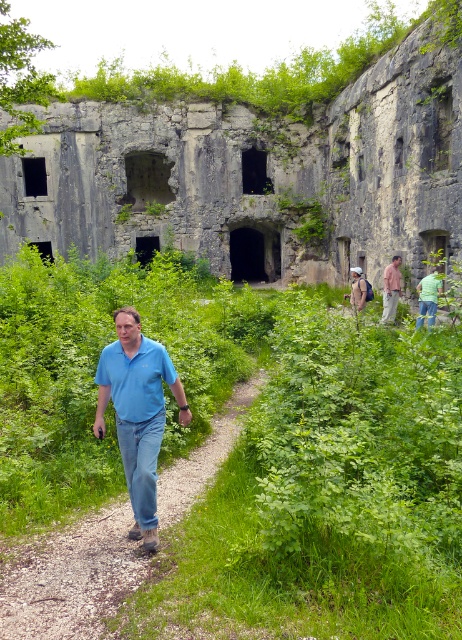
Is blue denim jeans at center to the left of pink fabric shirt at center from the viewer's perspective?

Correct, you'll find blue denim jeans at center to the left of pink fabric shirt at center.

Which is more to the left, blue denim jeans at center or pink fabric shirt at center?

blue denim jeans at center

Who is more distant from viewer, (x=180, y=390) or (x=385, y=310)?

Point (x=385, y=310)

Find the location of a particular element. The width and height of the screenshot is (462, 640). blue denim jeans at center is located at coordinates (138, 412).

From the picture: Does green leafy vegetation at center have a lesser height compared to gray stone ruins at center?

Correct, green leafy vegetation at center is not as tall as gray stone ruins at center.

What do you see at coordinates (249, 452) in the screenshot? This screenshot has width=462, height=640. I see `green leafy vegetation at center` at bounding box center [249, 452].

What do you see at coordinates (249, 452) in the screenshot? This screenshot has width=462, height=640. I see `green leafy vegetation at center` at bounding box center [249, 452].

Locate an element on the screen. This screenshot has width=462, height=640. green leafy vegetation at center is located at coordinates tap(249, 452).

Can you confirm if pink fabric shirt at center is positioned to the right of light blue shirt at center?

Yes, pink fabric shirt at center is to the right of light blue shirt at center.

Which of these two, pink fabric shirt at center or light blue shirt at center, stands taller?

With more height is pink fabric shirt at center.

Locate an element on the screen. pink fabric shirt at center is located at coordinates (390, 289).